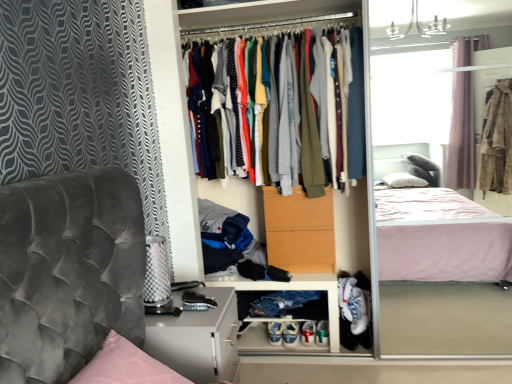
Question: Can you confirm if white leather sneakers at lower center, the 1th footwear from the left, is thinner than matte orange drawer at center?

Choices:
 (A) no
 (B) yes

Answer: (A)

Question: Is white leather sneakers at lower center, the second footwear in the right-to-left sequence, to the left of matte orange drawer at center from the viewer's perspective?

Choices:
 (A) yes
 (B) no

Answer: (A)

Question: Can you confirm if white leather sneakers at lower center, the second footwear in the right-to-left sequence, is wider than matte orange drawer at center?

Choices:
 (A) yes
 (B) no

Answer: (A)

Question: Is white leather sneakers at lower center, the 1th footwear from the left, shorter than matte orange drawer at center?

Choices:
 (A) yes
 (B) no

Answer: (A)

Question: Is white leather sneakers at lower center, the second footwear in the right-to-left sequence, far away from matte orange drawer at center?

Choices:
 (A) yes
 (B) no

Answer: (B)

Question: From a real-world perspective, is white leather sneakers at lower center, the 1th footwear from the left, below matte orange drawer at center?

Choices:
 (A) yes
 (B) no

Answer: (A)

Question: Is matte gray cabinet at lower left closer to camera compared to matte white dresser at center?

Choices:
 (A) no
 (B) yes

Answer: (B)

Question: Is matte gray cabinet at lower left at the right side of matte white dresser at center?

Choices:
 (A) no
 (B) yes

Answer: (A)

Question: Is matte gray cabinet at lower left at the left side of matte white dresser at center?

Choices:
 (A) yes
 (B) no

Answer: (A)

Question: From the image's perspective, is matte gray cabinet at lower left above matte white dresser at center?

Choices:
 (A) no
 (B) yes

Answer: (A)

Question: Would you say matte gray cabinet at lower left is outside matte white dresser at center?

Choices:
 (A) no
 (B) yes

Answer: (B)

Question: Is matte gray cabinet at lower left looking in the opposite direction of matte white dresser at center?

Choices:
 (A) yes
 (B) no

Answer: (B)

Question: From a real-world perspective, does matte orange drawer at center sit lower than multicolored fabric shirts at center?

Choices:
 (A) yes
 (B) no

Answer: (A)